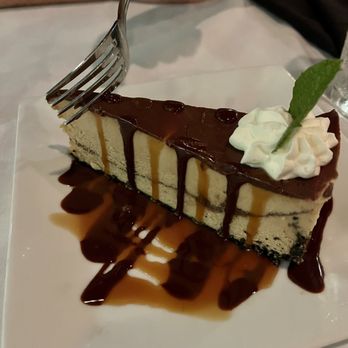
Where is `fork`? The image size is (348, 348). fork is located at coordinates (119, 44).